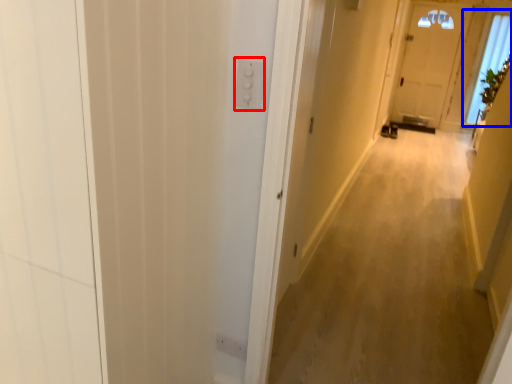
Question: Which point is further to the camera, electric outlet (highlighted by a red box) or window (highlighted by a blue box)?

Choices:
 (A) electric outlet
 (B) window

Answer: (B)